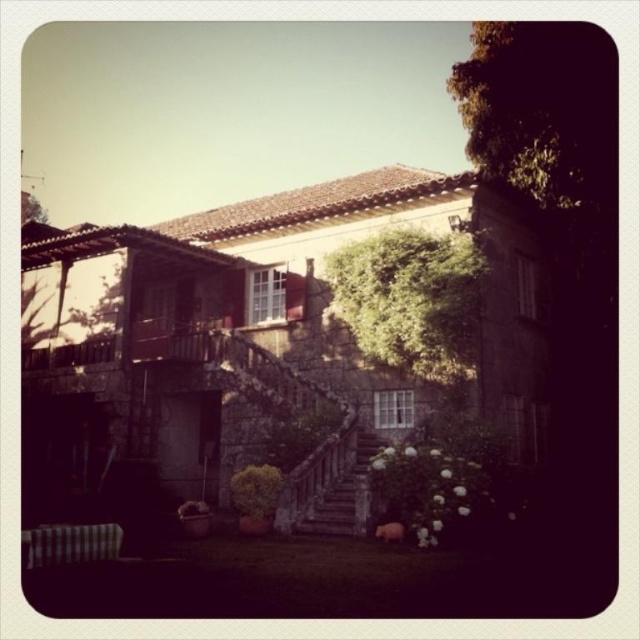
Who is more distant from viewer, (326, 492) or (339, 518)?

The point (326, 492) is more distant.

Who is positioned more to the left, stone textured stairs at center or rustic stone stairs at center?

stone textured stairs at center

Is point (362, 486) positioned in front of point (324, 497)?

Yes, it is.

Find the location of a particular element. The height and width of the screenshot is (640, 640). stone textured stairs at center is located at coordinates (314, 445).